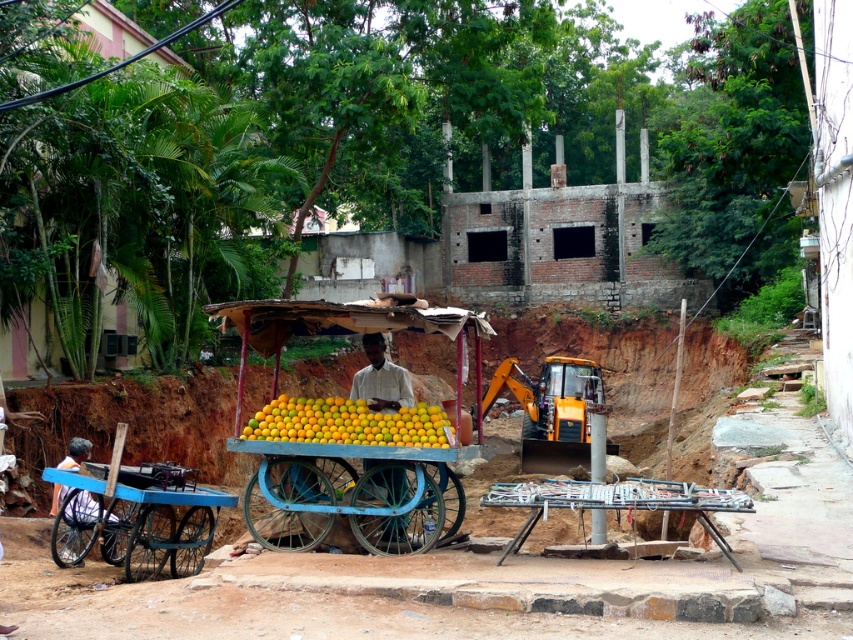
Which is more to the right, blue painted wood cart at lower left or metallic silver grill at lower center?

From the viewer's perspective, metallic silver grill at lower center appears more on the right side.

Describe the element at coordinates (136, 525) in the screenshot. The height and width of the screenshot is (640, 853). I see `blue painted wood cart at lower left` at that location.

Is point (125, 515) closer to viewer compared to point (573, 486)?

No, (125, 515) is behind (573, 486).

Identify the location of blue painted wood cart at lower left. The width and height of the screenshot is (853, 640). (136, 525).

Can you confirm if blue painted wood cart at lower left is positioned to the right of yellow matte oranges at center?

No, blue painted wood cart at lower left is not to the right of yellow matte oranges at center.

Based on the photo, which is above, blue painted wood cart at lower left or yellow matte oranges at center?

Positioned higher is yellow matte oranges at center.

You are a GUI agent. You are given a task and a screenshot of the screen. Output one action in this format:
    pyautogui.click(x=<x>, y=<y>)
    Task: Click on the blue painted wood cart at lower left
    The image size is (853, 640).
    Given the screenshot: What is the action you would take?
    pyautogui.click(x=136, y=525)

Identify the location of blue painted wood cart at lower left. This screenshot has width=853, height=640. (136, 525).

Does wooden cart at center have a greater height compared to white matte man at center?

Correct, wooden cart at center is much taller as white matte man at center.

Measure the distance between point [363,524] and camera.

Point [363,524] and camera are 11.92 meters apart from each other.

Locate an element on the screen. The height and width of the screenshot is (640, 853). wooden cart at center is located at coordinates (344, 436).